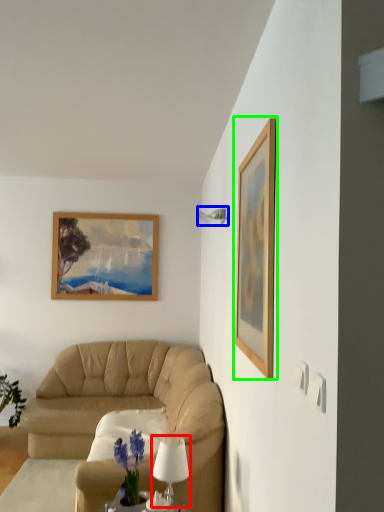
Question: Which object is the farthest from table lamp (highlighted by a red box)? Choose among these: lamp (highlighted by a blue box) or picture frame (highlighted by a green box).

Choices:
 (A) lamp
 (B) picture frame

Answer: (A)